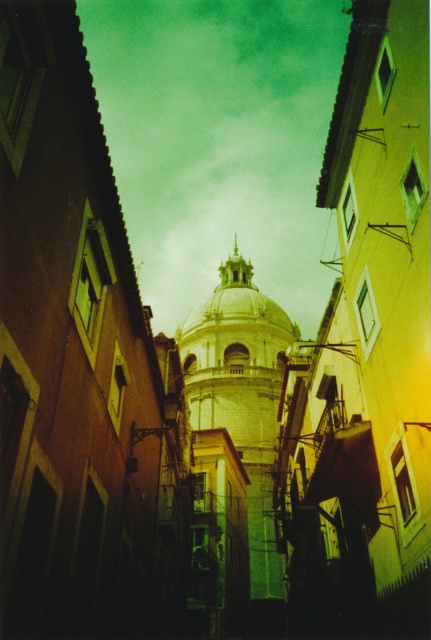
Question: Does white stone dome at center have a greater width compared to gold textured dome at center?

Choices:
 (A) yes
 (B) no

Answer: (B)

Question: Which of the following is the farthest from the observer?

Choices:
 (A) gold textured dome at center
 (B) white stone dome at center

Answer: (A)

Question: Does white stone dome at center have a lesser width compared to gold textured dome at center?

Choices:
 (A) no
 (B) yes

Answer: (B)

Question: Which object is farther from the camera taking this photo?

Choices:
 (A) white stone dome at center
 (B) gold textured dome at center

Answer: (B)

Question: Does white stone dome at center have a lesser width compared to gold textured dome at center?

Choices:
 (A) no
 (B) yes

Answer: (B)